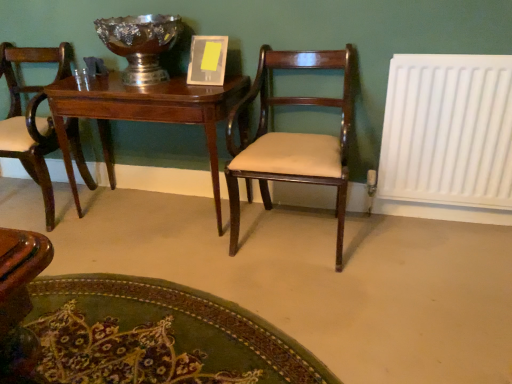
Locate an element on the screen. free space between matte wood chair at left, marked as the 2th chair in a right-to-left arrangement, and mahogany wood table at center is located at coordinates (113, 233).